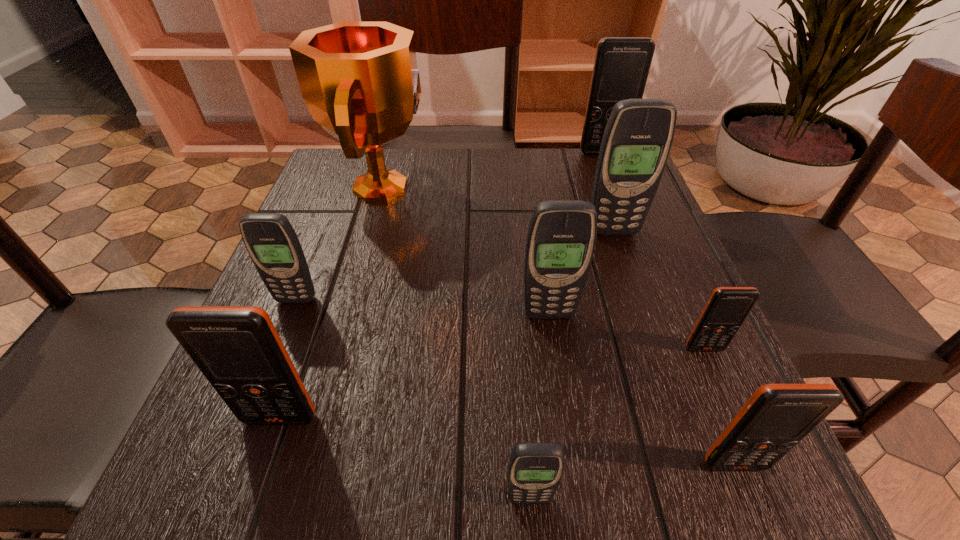
This screenshot has height=540, width=960. Identify the location of vacant area at the far edge. (466, 170).

The width and height of the screenshot is (960, 540). I want to click on free region at the right edge, so click(x=617, y=279).

Where is `free space at the far left corner`? This screenshot has height=540, width=960. free space at the far left corner is located at coordinates (363, 157).

Identify the location of vacant region at the far right corner. (581, 184).

At what (x,y) coordinates should I click in order to perform the action: click on vacant area that lies between the leftmost orange cellular telephone and the second nearest gray cellular telephone. Please return your answer as a coordinate pair (x, y). Looking at the image, I should click on (415, 366).

Image resolution: width=960 pixels, height=540 pixels. Find the location of `vacant region between the biggest gray cellular telephone and the seventh farthest object`. vacant region between the biggest gray cellular telephone and the seventh farthest object is located at coordinates (446, 325).

Find the location of a particular element. The width and height of the screenshot is (960, 540). vacant point located between the eighth farthest object and the award is located at coordinates (559, 326).

Identify the location of free space between the leftmost orange cellular telephone and the nearest orange cellular telephone. (x=508, y=441).

Where is `vacant region between the smallest gray cellular telephone and the farthest orange cellular telephone`? This screenshot has height=540, width=960. vacant region between the smallest gray cellular telephone and the farthest orange cellular telephone is located at coordinates (566, 325).

Identify the location of vacant area that lies between the leftmost orange cellular telephone and the biggest orange cellular telephone. The width and height of the screenshot is (960, 540). (x=442, y=285).